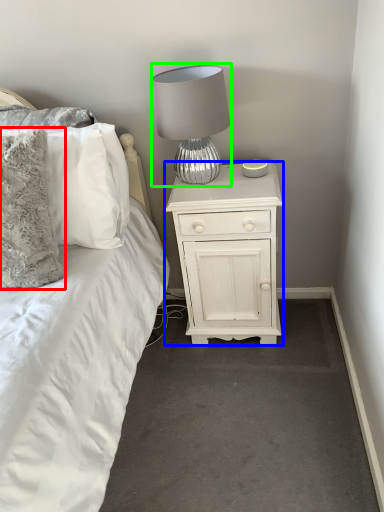
Question: Which is nearer to the pillow (highlighted by a red box)? nightstand (highlighted by a blue box) or lamp (highlighted by a green box).

Choices:
 (A) nightstand
 (B) lamp

Answer: (B)